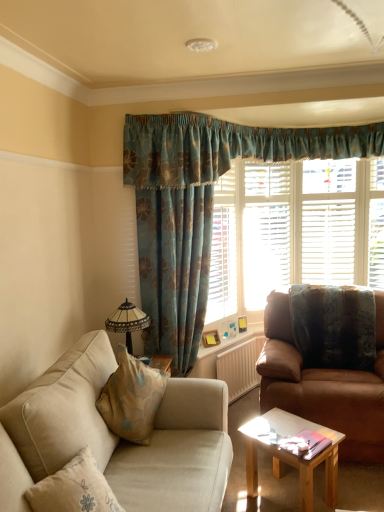
Question: Looking at their shapes, would you say white textured radiator at center is wider or thinner than beige fabric couch at lower left, which is counted as the first studio couch, starting from the left?

Choices:
 (A) thin
 (B) wide

Answer: (A)

Question: Is white textured radiator at center in front of or behind beige fabric couch at lower left, which ranks as the second studio couch in back-to-front order, in the image?

Choices:
 (A) front
 (B) behind

Answer: (B)

Question: Based on their relative distances, which object is farther from the light brown wooden coffee table at center?

Choices:
 (A) stained glass lampshade at left
 (B) beige fabric couch at lower left, which is the first studio couch in front-to-back order
 (C) white wooden shutters at center
 (D) white textured radiator at center
 (E) brown leather couch at right, arranged as the 1th studio couch when viewed from the right

Answer: (C)

Question: Based on their relative distances, which object is nearer to the stained glass lampshade at left?

Choices:
 (A) white wooden shutters at center
 (B) white textured radiator at center
 (C) beige fabric couch at lower left, the 2th studio couch positioned from the right
 (D) textured brown pillow at right
 (E) brown leather couch at right, arranged as the 1th studio couch when viewed from the back

Answer: (B)